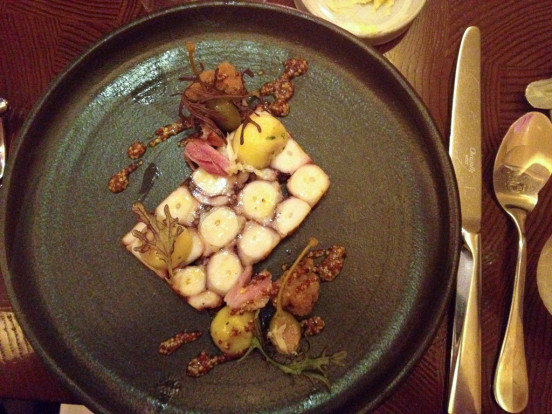
You are a GUI agent. You are given a task and a screenshot of the screen. Output one action in this format:
    pyautogui.click(x=<x>, y=<y>)
    Task: Click on the spoon handle
    This screenshot has height=414, width=552.
    Given the screenshot: What is the action you would take?
    pyautogui.click(x=511, y=352)